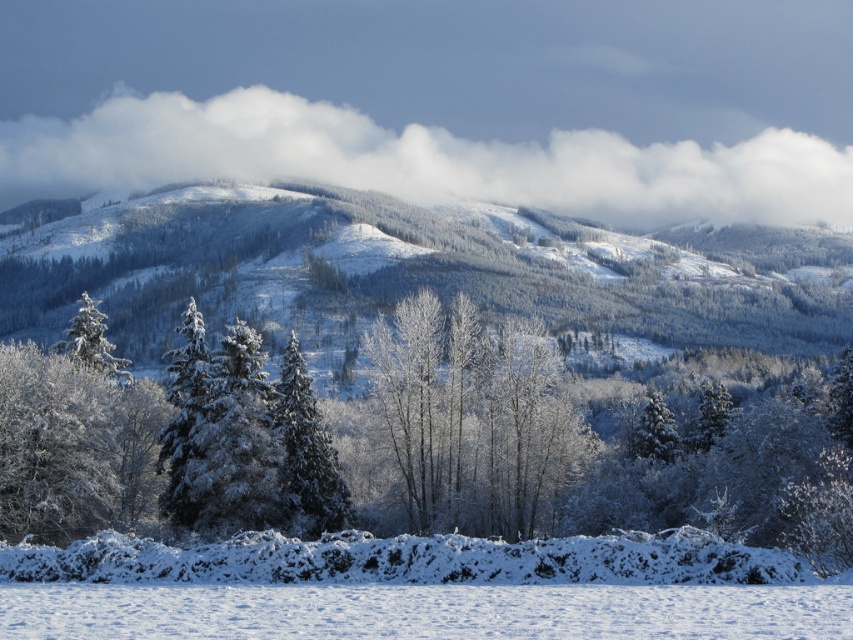
You are navigating through the winter landscape and want to move from the starting point at point (293, 532) to the destination at point (746, 278). Considering the terrain and obstacles, will you pass through the dense forested area behind the snow hedge?

Yes, you will pass through the dense forested area behind the snow hedge because point (746, 278) is behind point (293, 532), indicating the destination is further into the forested region beyond the hedge.